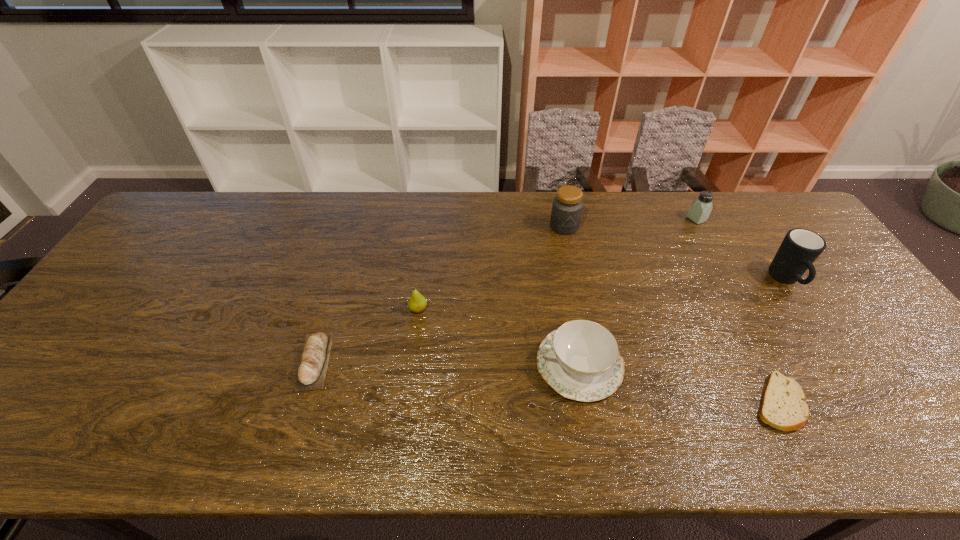
In order to click on the shortest object in this screenshot , I will do pyautogui.click(x=783, y=406).

Find the location of a particular element. The image size is (960, 540). vacant region located 0.400m on the side of the mug with the handle is located at coordinates (891, 438).

The image size is (960, 540). Find the location of `free space located on the surface of the jar near the warning symbol`. free space located on the surface of the jar near the warning symbol is located at coordinates (574, 273).

You are a GUI agent. You are given a task and a screenshot of the screen. Output one action in this format:
    pyautogui.click(x=<x>, y=<y>)
    Task: Click on the free region located 0.250m on the left of the saltshaker
    
    Given the screenshot: What is the action you would take?
    pyautogui.click(x=612, y=219)

The height and width of the screenshot is (540, 960). Identify the location of free location located on the right of the pear. (468, 309).

Locate an element on the screen. This screenshot has width=960, height=540. free region located on the handle side of the chinaware is located at coordinates (446, 365).

Identify the location of blank space located on the handle side of the chinaware. The height and width of the screenshot is (540, 960). (421, 365).

At what (x,y) coordinates should I click in order to perform the action: click on free space located 0.240m on the handle side of the chinaware. Please return your answer as a coordinate pair (x, y). Image resolution: width=960 pixels, height=540 pixels. Looking at the image, I should click on (438, 365).

The height and width of the screenshot is (540, 960). What are the coordinates of `vacant space located on the front of the left pita bread` in the screenshot? It's located at (289, 447).

You are a GUI agent. You are given a task and a screenshot of the screen. Output one action in this format:
    pyautogui.click(x=<x>, y=<y>)
    Task: Click on the vacant region located 0.080m on the left of the right pita bread
    The height and width of the screenshot is (540, 960).
    Given the screenshot: What is the action you would take?
    pyautogui.click(x=716, y=402)